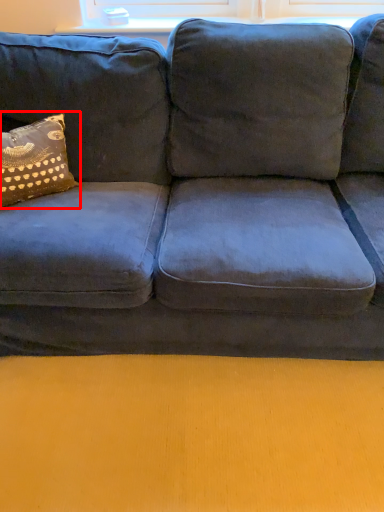
Question: From the image's perspective, where is pillow (annotated by the red box) located in relation to window sill in the image?

Choices:
 (A) below
 (B) above

Answer: (A)